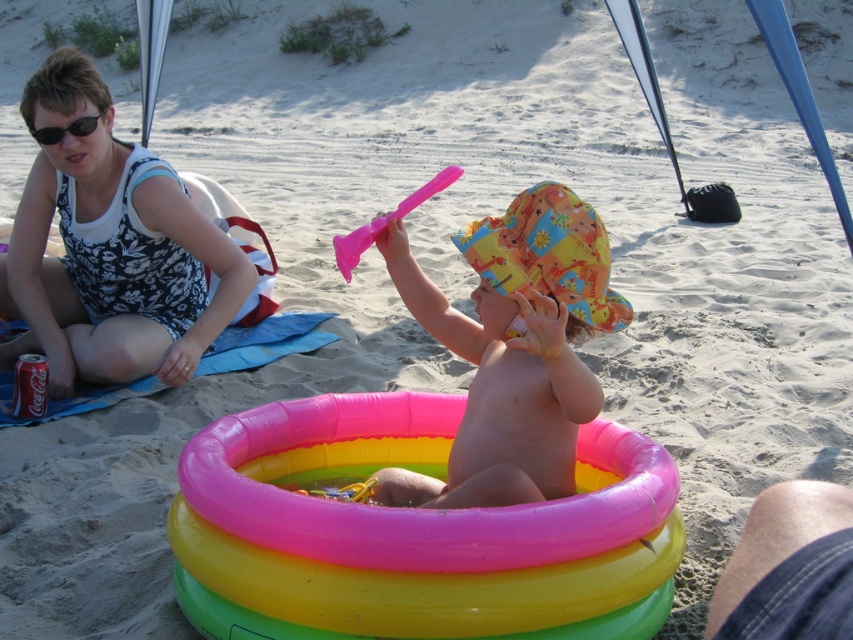
Question: Can you confirm if printed fabric sunhat at center is positioned to the left of coca-cola can at lower left?

Choices:
 (A) no
 (B) yes

Answer: (A)

Question: Among these objects, which one is nearest to the camera?

Choices:
 (A) printed fabric tank top at upper left
 (B) rubber inflatable pool at center
 (C) black plastic sunglasses at upper left

Answer: (B)

Question: Which point appears farthest from the camera in this image?

Choices:
 (A) (78, 128)
 (B) (36, 413)
 (C) (409, 204)
 (D) (595, 381)

Answer: (B)

Question: Which object is positioned closest to the printed fabric sunhat at center?

Choices:
 (A) rubber inflatable pool at center
 (B) coca-cola can at lower left
 (C) pink plastic spoon at center

Answer: (A)

Question: Is rubber inflatable pool at center smaller than coca-cola can at lower left?

Choices:
 (A) no
 (B) yes

Answer: (A)

Question: Does coca-cola can at lower left have a smaller size compared to black plastic sunglasses at upper left?

Choices:
 (A) no
 (B) yes

Answer: (B)